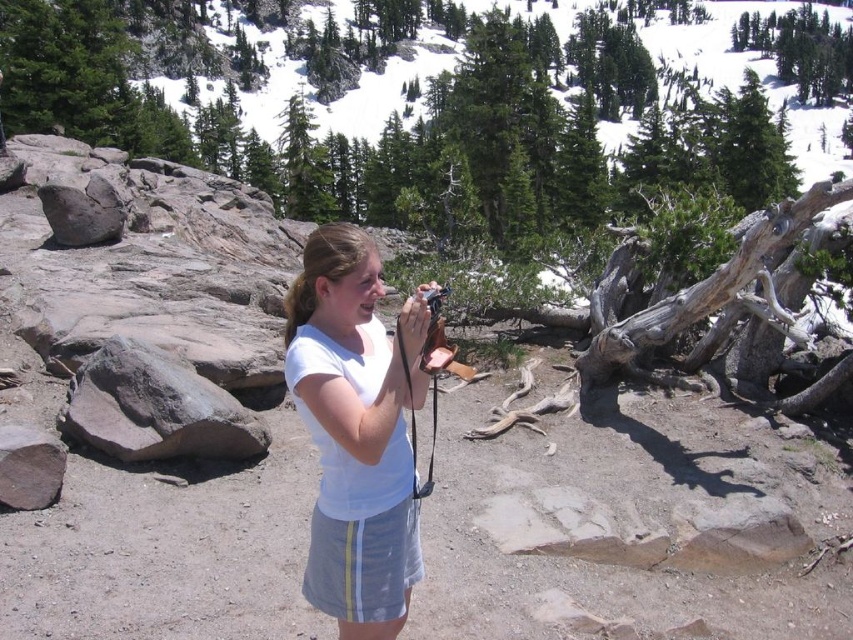
Who is positioned more to the right, white cotton shirt at center or gray rock at left?

white cotton shirt at center

Who is lower down, white cotton shirt at center or gray rock at left?

Positioned lower is gray rock at left.

Does point (299, 394) come in front of point (258, 454)?

That is True.

Find the location of a particular element. The width and height of the screenshot is (853, 640). white cotton shirt at center is located at coordinates (357, 432).

Does point (347, 488) come closer to viewer compared to point (94, 227)?

That is True.

Measure the distance from white cotton shirt at center to smooth gray rock at left.

white cotton shirt at center is 14.27 meters from smooth gray rock at left.

Is point (357, 397) positioned after point (120, 212)?

No, (357, 397) is closer to viewer.

Find the location of `white cotton shirt at center`. white cotton shirt at center is located at coordinates (357, 432).

Does gray rock at left appear on the left side of smooth gray rock at left?

No, gray rock at left is not to the left of smooth gray rock at left.

Is point (102, 349) closer to camera compared to point (91, 198)?

Yes, point (102, 349) is closer to viewer.

Locate an element on the screen. The image size is (853, 640). gray rock at left is located at coordinates (155, 406).